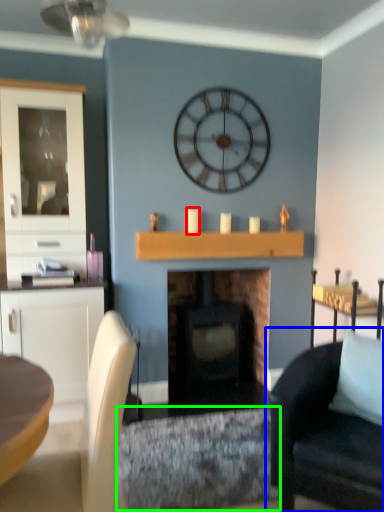
Question: Considering the real-world distances, which object is farthest from candle (highlighted by a red box)? chair (highlighted by a blue box) or molding (highlighted by a green box)?

Choices:
 (A) chair
 (B) molding

Answer: (A)